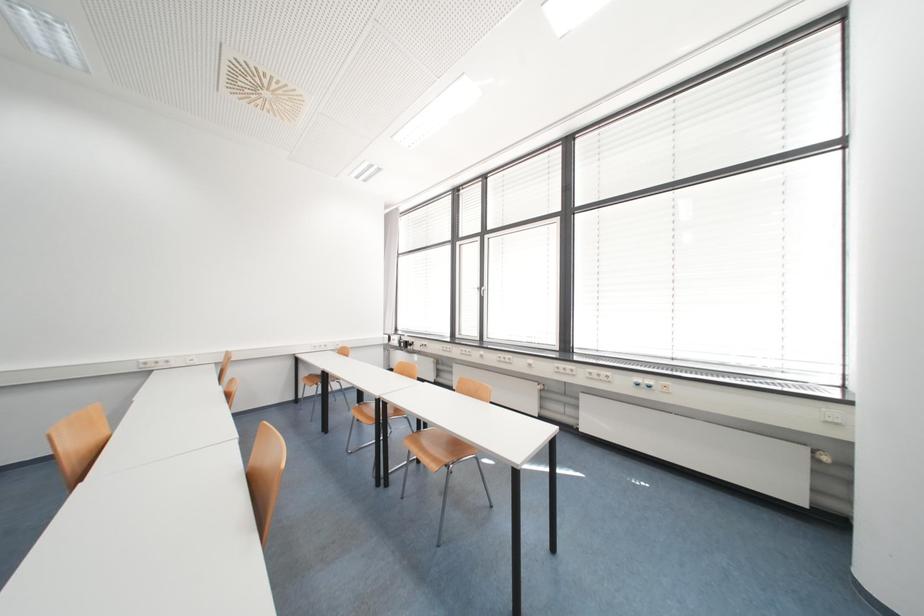
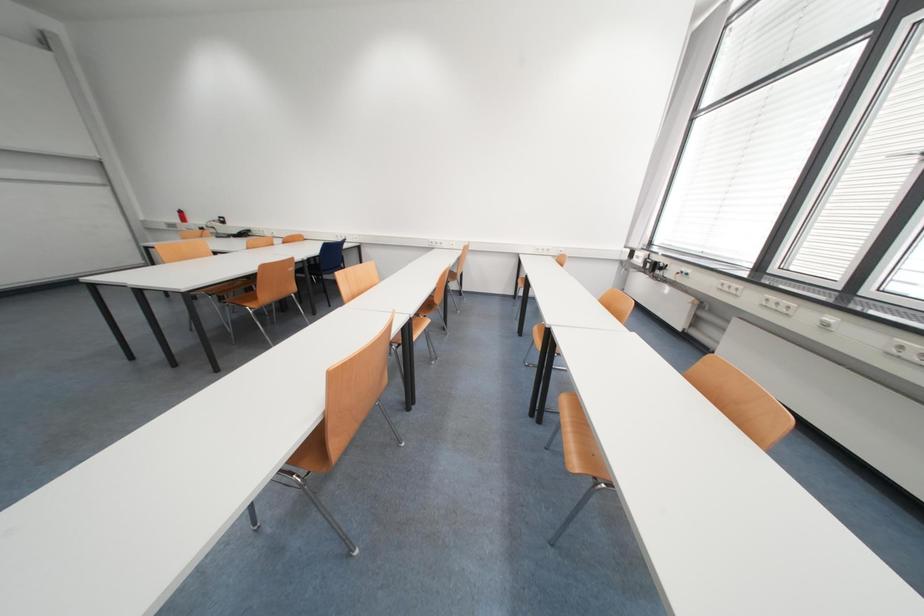
The first image is from the beginning of the video and the second image is from the end. How did the camera likely rotate when shooting the video?

The rotation direction of the camera is left-down.